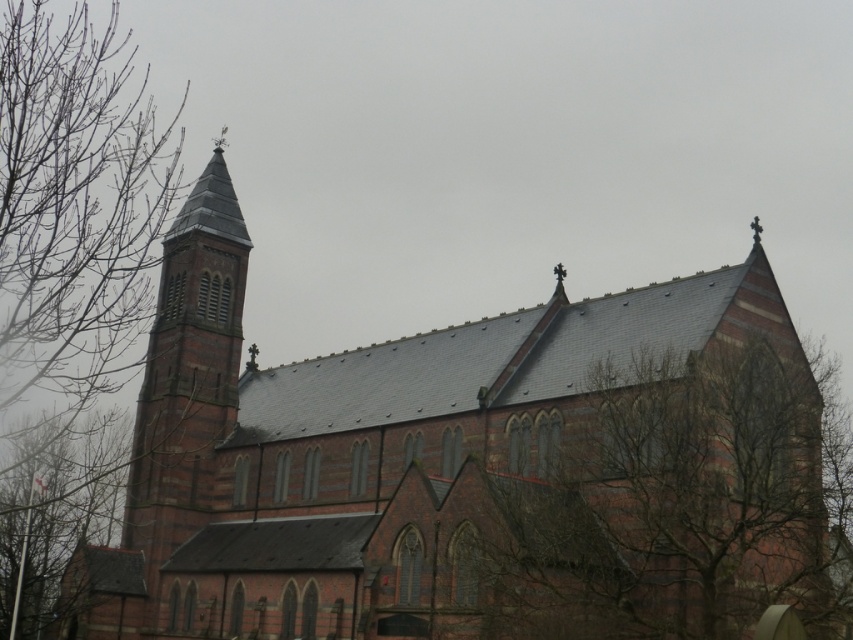
Does point (376, 611) come closer to viewer compared to point (740, 348)?

Yes, it is.

Between point (555, 392) and point (645, 362), which one is positioned behind?

Point (555, 392)

Identify the location of red brick church at center. (463, 467).

Where is `red brick church at center`? This screenshot has height=640, width=853. red brick church at center is located at coordinates (463, 467).

Which is more to the left, red brick church at center or bare branches at left?

From the viewer's perspective, bare branches at left appears more on the left side.

Is red brick church at center positioned before bare branches at left?

Yes, red brick church at center is closer to the viewer.

Describe the element at coordinates (463, 467) in the screenshot. The width and height of the screenshot is (853, 640). I see `red brick church at center` at that location.

At what (x,y) coordinates should I click in order to perform the action: click on red brick church at center. Please return your answer as a coordinate pair (x, y). Looking at the image, I should click on (463, 467).

Is bare branches at lower right behind bare branches at left?

No, it is not.

Between point (527, 593) and point (119, 179), which one is positioned in front?

Point (527, 593)

Image resolution: width=853 pixels, height=640 pixels. What are the coordinates of `bare branches at lower right` in the screenshot? It's located at (672, 508).